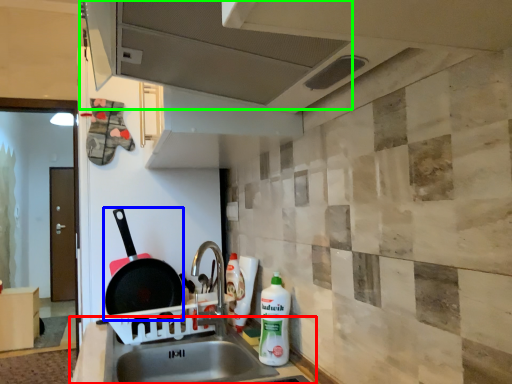
Question: Which is farther away from counter top (highlighted by a red box)? frying pan (highlighted by a blue box) or exhaust hood (highlighted by a green box)?

Choices:
 (A) frying pan
 (B) exhaust hood

Answer: (B)